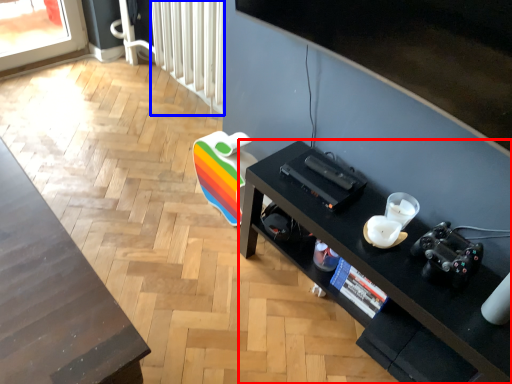
Question: Which object appears farthest to the camera in this image, desk (highlighted by a red box) or radiator (highlighted by a blue box)?

Choices:
 (A) desk
 (B) radiator

Answer: (B)